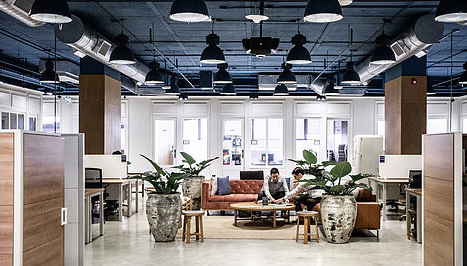
The width and height of the screenshot is (467, 266). What are the coordinates of `5 rows of lights` in the screenshot? It's located at (381, 57), (304, 53), (219, 56), (131, 52), (47, 68).